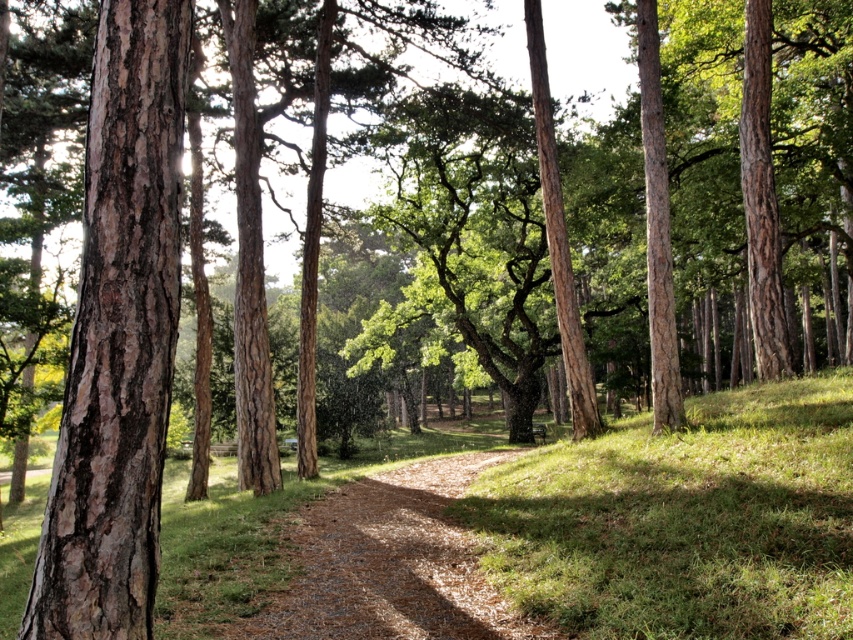
You are a hiker trying to determine the safest path through the forest. You notice two features on the ground ahead of you. Which of the two, the smooth brown bark at left or the brown gravel path at center, is narrower and might be harder to walk on?

The smooth brown bark at left is narrower than the brown gravel path at center, so it might be harder to walk on due to its lesser width.